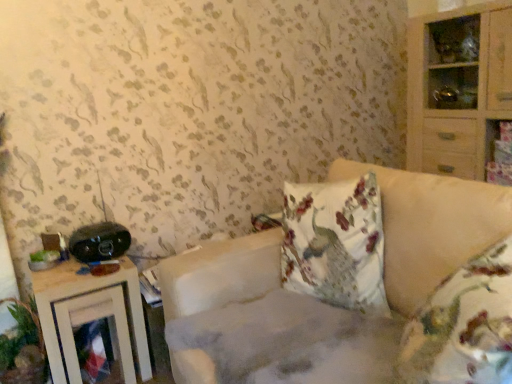
Question: Should I look upward or downward to see light wood cabinet at right?

Choices:
 (A) down
 (B) up

Answer: (B)

Question: Is light wood cabinet at right aimed at black plastic stereo at left?

Choices:
 (A) yes
 (B) no

Answer: (A)

Question: From the image's perspective, is light wood cabinet at right located beneath black plastic stereo at left?

Choices:
 (A) no
 (B) yes

Answer: (A)

Question: Can black plastic stereo at left be found inside light wood cabinet at right?

Choices:
 (A) no
 (B) yes

Answer: (A)

Question: Does light wood cabinet at right come behind black plastic stereo at left?

Choices:
 (A) yes
 (B) no

Answer: (A)

Question: From the image's perspective, is light wood cabinet at right located above black plastic stereo at left?

Choices:
 (A) yes
 (B) no

Answer: (A)

Question: Can you confirm if light wood cabinet at right is wider than black plastic stereo at left?

Choices:
 (A) yes
 (B) no

Answer: (A)

Question: Is green leafy plant at lower left a part of black plastic stereo at left?

Choices:
 (A) no
 (B) yes

Answer: (A)

Question: Is black plastic stereo at left in contact with green leafy plant at lower left?

Choices:
 (A) no
 (B) yes

Answer: (A)

Question: Does black plastic stereo at left have a lesser height compared to green leafy plant at lower left?

Choices:
 (A) yes
 (B) no

Answer: (A)

Question: From a real-world perspective, is black plastic stereo at left under green leafy plant at lower left?

Choices:
 (A) no
 (B) yes

Answer: (A)

Question: From the image's perspective, is black plastic stereo at left located above green leafy plant at lower left?

Choices:
 (A) no
 (B) yes

Answer: (B)

Question: Can you confirm if black plastic stereo at left is taller than green leafy plant at lower left?

Choices:
 (A) yes
 (B) no

Answer: (B)

Question: Considering the relative sizes of wooden nightstand at left and fluffy beige couch at center in the image provided, is wooden nightstand at left thinner than fluffy beige couch at center?

Choices:
 (A) no
 (B) yes

Answer: (B)